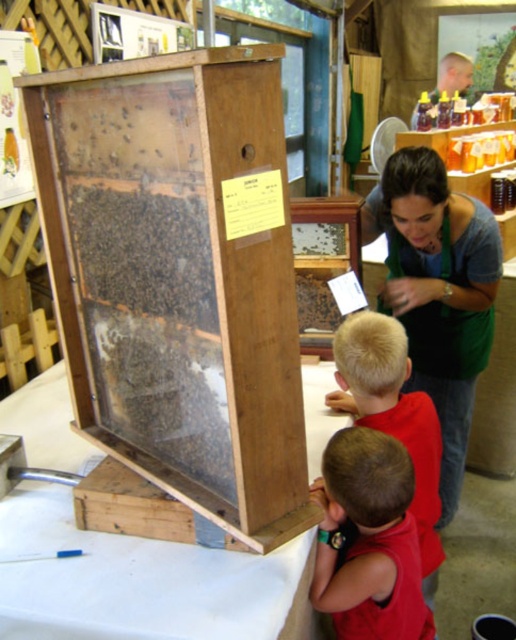
Question: From the image, what is the correct spatial relationship of wooden beehive at center in relation to green fabric apron at center?

Choices:
 (A) below
 (B) above

Answer: (B)

Question: Estimate the real-world distances between objects in this image. Which object is farther from the black fuzzy bee at center?

Choices:
 (A) translucent wood honeycomb at center
 (B) wooden beehive at center

Answer: (B)

Question: Which of the following is the closest to the observer?

Choices:
 (A) (166, 140)
 (B) (454, 83)
 (C) (76, 131)

Answer: (A)

Question: Where is green fabric apron at center located in relation to black fuzzy bee at center in the image?

Choices:
 (A) above
 (B) below

Answer: (B)

Question: Does smooth skin head at upper right have a larger size compared to translucent wooden frame at center?

Choices:
 (A) yes
 (B) no

Answer: (A)

Question: Which object appears farthest from the camera in this image?

Choices:
 (A) smooth skin head at upper right
 (B) translucent wooden frame at center

Answer: (A)